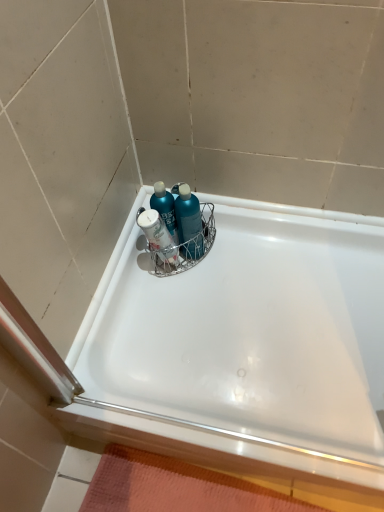
Identify the location of free space on the front side of teal glossy bottle at center. This screenshot has height=512, width=384. (170, 309).